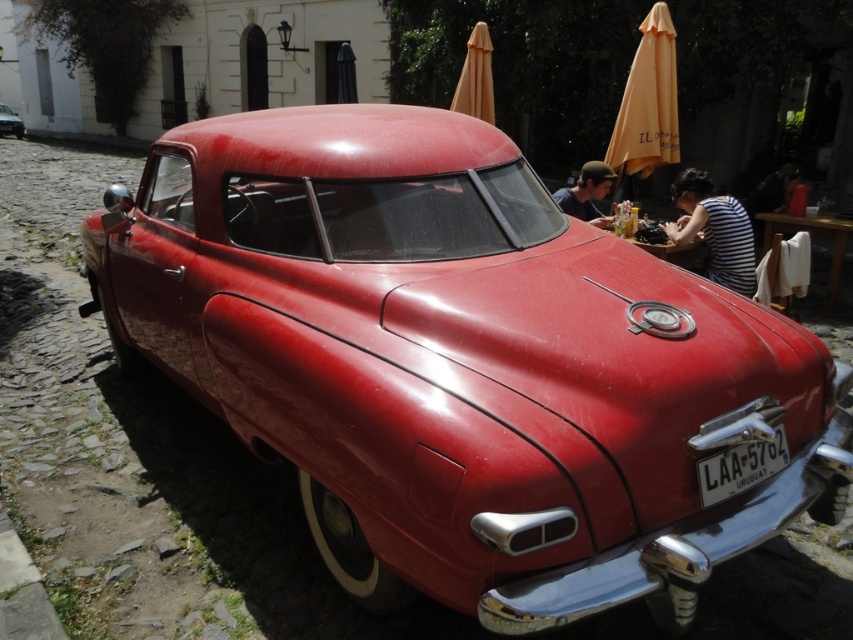
You are a photographer taking a picture of the vintage red car. You notice the striped fabric shirt at center and the metallic silver license plate at lower center in your viewfinder. Which object should you focus on if you want to capture the taller one in the scene?

The striped fabric shirt at center is much taller than the metallic silver license plate at lower center, so you should focus on the striped fabric shirt at center to capture the taller one in the scene.

You are standing in front of the vintage red car on the cobblestone street. You notice two points marked on the car. One is at coordinate point (718, 499) and the other at point (788, 163). Which of these two points is closer to you?

Point (718, 499) is closer to the viewer than point (788, 163).